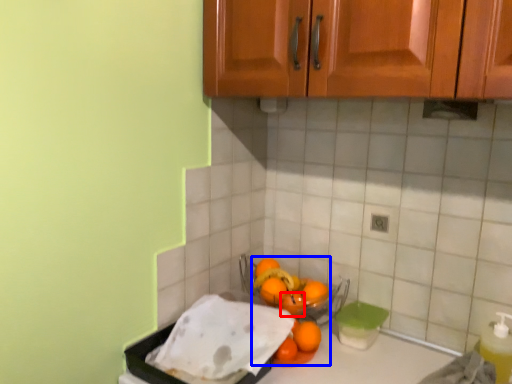
Question: Which object appears farthest to the camera in this image, orange (highlighted by a red box) or wash (highlighted by a blue box)?

Choices:
 (A) orange
 (B) wash

Answer: (A)